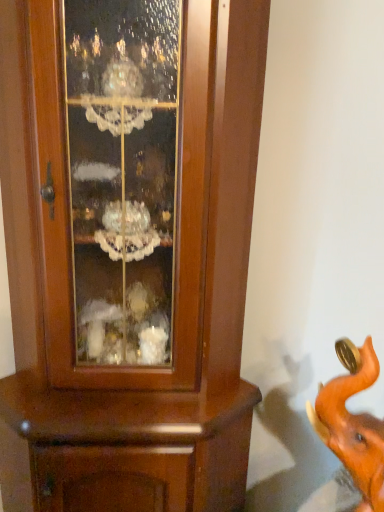
Question: Relative to orange matte elephant at lower right, is brown wooden cupboard at center in front or behind?

Choices:
 (A) behind
 (B) front

Answer: (A)

Question: Is brown wooden cupboard at center inside the boundaries of orange matte elephant at lower right, or outside?

Choices:
 (A) inside
 (B) outside

Answer: (B)

Question: Considering the positions of brown wooden cupboard at center and orange matte elephant at lower right in the image, is brown wooden cupboard at center wider or thinner than orange matte elephant at lower right?

Choices:
 (A) thin
 (B) wide

Answer: (B)

Question: From the image's perspective, is orange matte elephant at lower right located above or below brown wooden cupboard at center?

Choices:
 (A) above
 (B) below

Answer: (B)

Question: Does point (355, 452) appear closer or farther from the camera than point (226, 245)?

Choices:
 (A) farther
 (B) closer

Answer: (B)

Question: In the image, is orange matte elephant at lower right on the left side or the right side of brown wooden cupboard at center?

Choices:
 (A) left
 (B) right

Answer: (B)

Question: Considering the positions of orange matte elephant at lower right and brown wooden cupboard at center in the image, is orange matte elephant at lower right wider or thinner than brown wooden cupboard at center?

Choices:
 (A) wide
 (B) thin

Answer: (B)